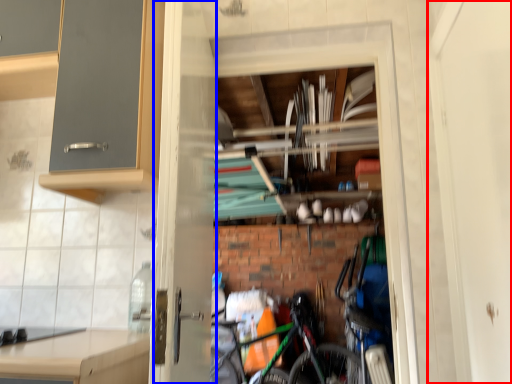
Question: Which of the following is the closest to the observer, screen door (highlighted by a red box) or screen door (highlighted by a blue box)?

Choices:
 (A) screen door
 (B) screen door

Answer: (A)